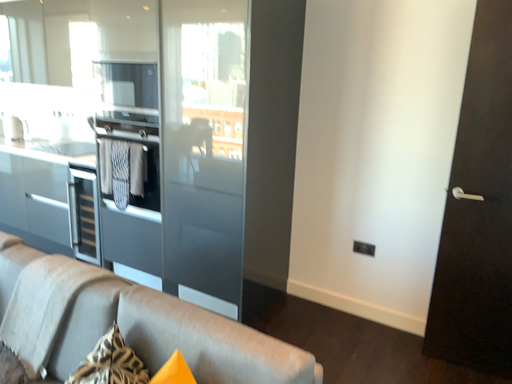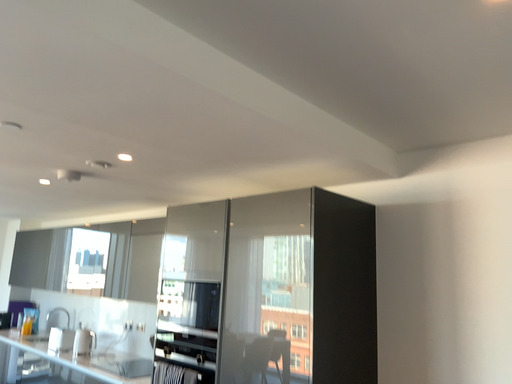
Question: How did the camera likely rotate when shooting the video?

Choices:
 (A) rotated upward
 (B) rotated downward

Answer: (A)